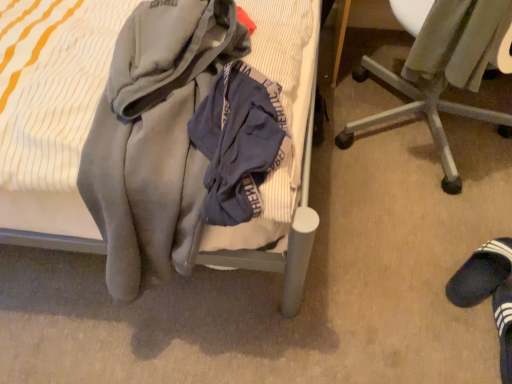
You are a GUI agent. You are given a task and a screenshot of the screen. Output one action in this format:
    pyautogui.click(x=<x>, y=<y>)
    Task: Click on the black suede slipper at lower right
    The height and width of the screenshot is (384, 512).
    Given the screenshot: What is the action you would take?
    pyautogui.click(x=481, y=273)

Locate an element on the screen. This screenshot has width=512, height=384. velvet-like gray sweater at lower right is located at coordinates (458, 41).

What do you see at coordinates (296, 204) in the screenshot? I see `soft gray blanket at center` at bounding box center [296, 204].

This screenshot has height=384, width=512. In order to click on black suede slipper at lower right in this screenshot , I will do `click(481, 273)`.

From the image's perspective, which one is positioned lower, metallic silver chair at lower right or soft gray blanket at center?

metallic silver chair at lower right.

Based on their positions, is metallic silver chair at lower right located to the left or right of soft gray blanket at center?

metallic silver chair at lower right is to the right of soft gray blanket at center.

Is metallic silver chair at lower right positioned before soft gray blanket at center?

No, metallic silver chair at lower right is further to the viewer.

From a real-world perspective, between metallic silver chair at lower right and soft gray blanket at center, who is vertically higher?

From a 3D spatial view, soft gray blanket at center is above.

Between black suede slipper at lower right and soft gray blanket at center, which one is positioned behind?

black suede slipper at lower right is behind.

Looking at this image, does black suede slipper at lower right have a greater width compared to soft gray blanket at center?

Incorrect, the width of black suede slipper at lower right does not surpass that of soft gray blanket at center.

Which is in front, point (505, 276) or point (301, 253)?

The point (301, 253) is more forward.

From a real-world perspective, is black suede slipper at lower right physically below soft gray blanket at center?

Yes, from a real-world perspective, black suede slipper at lower right is beneath soft gray blanket at center.

Is velvet-like gray sweater at lower right spatially inside metallic silver chair at lower right, or outside of it?

velvet-like gray sweater at lower right can be found inside metallic silver chair at lower right.

From the image's perspective, is velvet-like gray sweater at lower right located beneath metallic silver chair at lower right?

Correct, velvet-like gray sweater at lower right appears lower than metallic silver chair at lower right in the image.

Does velvet-like gray sweater at lower right have a lesser height compared to metallic silver chair at lower right?

Indeed, velvet-like gray sweater at lower right has a lesser height compared to metallic silver chair at lower right.

Image resolution: width=512 pixels, height=384 pixels. What are the coordinates of `chair in front of the velvet-like gray sweater at lower right` in the screenshot? It's located at (421, 112).

Is soft gray blanket at center located outside black suede slipper at lower right?

soft gray blanket at center is positioned outside black suede slipper at lower right.

Which point is more distant from viewer, (42, 243) or (494, 285)?

The point (494, 285) is behind.

Considering the sizes of objects soft gray blanket at center and black suede slipper at lower right in the image provided, who is taller, soft gray blanket at center or black suede slipper at lower right?

soft gray blanket at center is taller.

Is metallic silver chair at lower right to the right of black suede slipper at lower right from the viewer's perspective?

In fact, metallic silver chair at lower right is to the left of black suede slipper at lower right.

Based on their sizes in the image, would you say metallic silver chair at lower right is bigger or smaller than black suede slipper at lower right?

In the image, metallic silver chair at lower right appears to be larger than black suede slipper at lower right.

Is metallic silver chair at lower right oriented away from black suede slipper at lower right?

That's not correct — metallic silver chair at lower right is not looking away from black suede slipper at lower right.

From a real-world perspective, is metallic silver chair at lower right beneath black suede slipper at lower right?

Incorrect, from a real-world perspective, metallic silver chair at lower right is higher than black suede slipper at lower right.

Where is `sweater below the metallic silver chair at lower right (from the image's perspective)`? The width and height of the screenshot is (512, 384). sweater below the metallic silver chair at lower right (from the image's perspective) is located at coordinates (458, 41).

Which is closer, [364,63] or [448,34]?

Point [364,63] is positioned farther from the camera compared to point [448,34].

Is velvet-like gray sweater at lower right completely or partially inside metallic silver chair at lower right?

Yes, velvet-like gray sweater at lower right is a part of metallic silver chair at lower right.

Is black suede slipper at lower right located outside velvet-like gray sweater at lower right?

That's correct, black suede slipper at lower right is outside of velvet-like gray sweater at lower right.

Is black suede slipper at lower right in front of velvet-like gray sweater at lower right?

No, it is behind velvet-like gray sweater at lower right.

Is black suede slipper at lower right turned away from velvet-like gray sweater at lower right?

That's not correct — black suede slipper at lower right is not looking away from velvet-like gray sweater at lower right.

Image resolution: width=512 pixels, height=384 pixels. I want to click on bed lying above the metallic silver chair at lower right (from the image's perspective), so click(x=296, y=204).

You are a GUI agent. You are given a task and a screenshot of the screen. Output one action in this format:
    pyautogui.click(x=<x>, y=<y>)
    Task: Click on the bed in front of the black suede slipper at lower right
    The image size is (512, 384).
    Given the screenshot: What is the action you would take?
    pyautogui.click(x=296, y=204)

Considering their positions, is black suede slipper at lower right positioned closer to velvet-like gray sweater at lower right than metallic silver chair at lower right?

Based on the image, metallic silver chair at lower right appears to be nearer to velvet-like gray sweater at lower right.

From the image, which object appears to be nearer to metallic silver chair at lower right, black suede slipper at lower right or soft gray blanket at center?

black suede slipper at lower right.

When comparing their distances from velvet-like gray sweater at lower right, does metallic silver chair at lower right or soft gray blanket at center seem further?

Among the two, soft gray blanket at center is located further to velvet-like gray sweater at lower right.

Estimate the real-world distances between objects in this image. Which object is closer to metallic silver chair at lower right, black suede slipper at lower right or velvet-like gray sweater at lower right?

The object closer to metallic silver chair at lower right is velvet-like gray sweater at lower right.

Based on the photo, based on their spatial positions, is soft gray blanket at center or black suede slipper at lower right further from metallic silver chair at lower right?

soft gray blanket at center is positioned further to the anchor metallic silver chair at lower right.

From the picture: Considering their positions, is metallic silver chair at lower right positioned closer to velvet-like gray sweater at lower right than black suede slipper at lower right?

Based on the image, metallic silver chair at lower right appears to be nearer to velvet-like gray sweater at lower right.

Considering their positions, is black suede slipper at lower right positioned closer to soft gray blanket at center than velvet-like gray sweater at lower right?

velvet-like gray sweater at lower right is positioned closer to the anchor soft gray blanket at center.

When comparing their distances from soft gray blanket at center, does metallic silver chair at lower right or velvet-like gray sweater at lower right seem closer?

velvet-like gray sweater at lower right lies closer to soft gray blanket at center than the other object.

In order to click on chair between soft gray blanket at center and black suede slipper at lower right in this screenshot , I will do `click(421, 112)`.

The image size is (512, 384). I want to click on sweater located between soft gray blanket at center and metallic silver chair at lower right in the left-right direction, so click(x=458, y=41).

This screenshot has width=512, height=384. In order to click on sweater between metallic silver chair at lower right and black suede slipper at lower right vertically in this screenshot , I will do `click(458, 41)`.

Find the location of a particular element. This screenshot has width=512, height=384. sweater between soft gray blanket at center and black suede slipper at lower right in the horizontal direction is located at coordinates (458, 41).